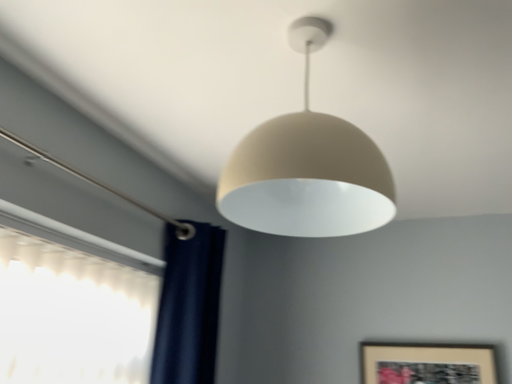
Question: Is matte beige lampshade at center next to wooden framed artwork at lower right?

Choices:
 (A) yes
 (B) no

Answer: (B)

Question: Can you confirm if matte beige lampshade at center is taller than wooden framed artwork at lower right?

Choices:
 (A) no
 (B) yes

Answer: (B)

Question: From the image's perspective, is matte beige lampshade at center below wooden framed artwork at lower right?

Choices:
 (A) yes
 (B) no

Answer: (B)

Question: From a real-world perspective, is matte beige lampshade at center located higher than wooden framed artwork at lower right?

Choices:
 (A) no
 (B) yes

Answer: (B)

Question: From the image's perspective, is matte beige lampshade at center on top of wooden framed artwork at lower right?

Choices:
 (A) no
 (B) yes

Answer: (B)

Question: Is matte beige lampshade at center turned away from wooden framed artwork at lower right?

Choices:
 (A) no
 (B) yes

Answer: (A)

Question: From a real-world perspective, is wooden framed artwork at lower right on top of matte beige lampshade at center?

Choices:
 (A) yes
 (B) no

Answer: (B)

Question: From the image's perspective, is wooden framed artwork at lower right under matte beige lampshade at center?

Choices:
 (A) no
 (B) yes

Answer: (B)

Question: Is wooden framed artwork at lower right facing towards matte beige lampshade at center?

Choices:
 (A) yes
 (B) no

Answer: (B)

Question: From the image's perspective, is wooden framed artwork at lower right on top of matte beige lampshade at center?

Choices:
 (A) yes
 (B) no

Answer: (B)

Question: Does wooden framed artwork at lower right have a lesser width compared to matte beige lampshade at center?

Choices:
 (A) no
 (B) yes

Answer: (B)

Question: Considering the relative sizes of wooden framed artwork at lower right and matte beige lampshade at center in the image provided, is wooden framed artwork at lower right smaller than matte beige lampshade at center?

Choices:
 (A) yes
 (B) no

Answer: (A)

Question: In terms of width, does wooden framed artwork at lower right look wider or thinner when compared to matte beige lampshade at center?

Choices:
 (A) thin
 (B) wide

Answer: (A)